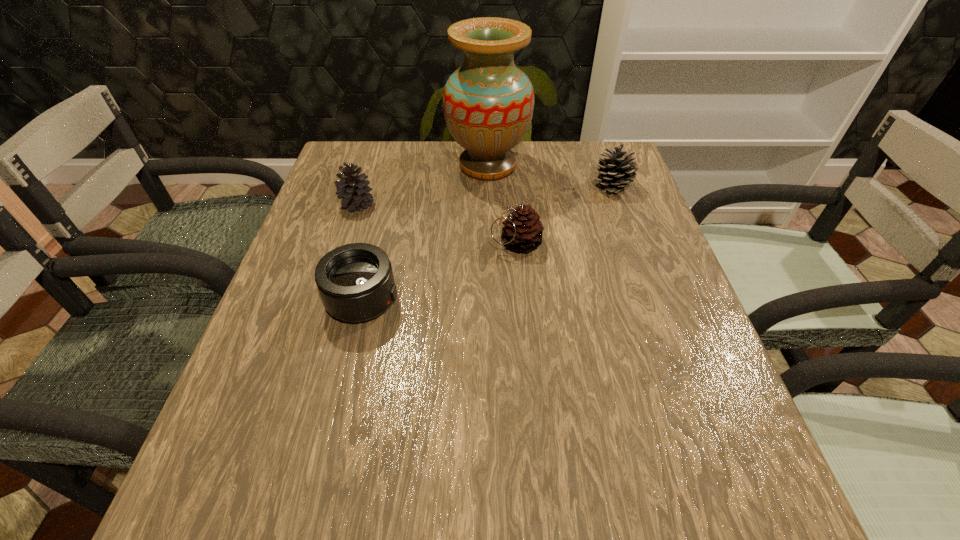
Locate an element on the screen. The width and height of the screenshot is (960, 540). empty space that is in between the rightmost pinecone and the tallest object is located at coordinates (550, 176).

You are a GUI agent. You are given a task and a screenshot of the screen. Output one action in this format:
    pyautogui.click(x=<x>, y=<y>)
    Task: Click on the free space between the nearest object and the nearest pinecone
    The width and height of the screenshot is (960, 540).
    Given the screenshot: What is the action you would take?
    pyautogui.click(x=440, y=272)

Locate an element on the screen. vacant space that's between the leftmost pinecone and the rightmost object is located at coordinates (485, 195).

In order to click on vacant space that is in between the leftmost pinecone and the rightmost object in this screenshot , I will do click(x=485, y=195).

Select which object is the third closest to the second pinecone from left to right. Please provide its 2D coordinates. Your answer should be formatted as a tuple, i.e. [(x, y)], where the tuple contains the x and y coordinates of a point satisfying the conditions above.

[(617, 169)]

Select which object appears as the third closest to the rightmost object. Please provide its 2D coordinates. Your answer should be formatted as a tuple, i.e. [(x, y)], where the tuple contains the x and y coordinates of a point satisfying the conditions above.

[(356, 283)]

Where is `pinecone that stands as the second closest to the rightmost pinecone`? The width and height of the screenshot is (960, 540). pinecone that stands as the second closest to the rightmost pinecone is located at coordinates point(353,191).

Where is `pinecone that is the second closest to the leftmost pinecone`? pinecone that is the second closest to the leftmost pinecone is located at coordinates (617, 169).